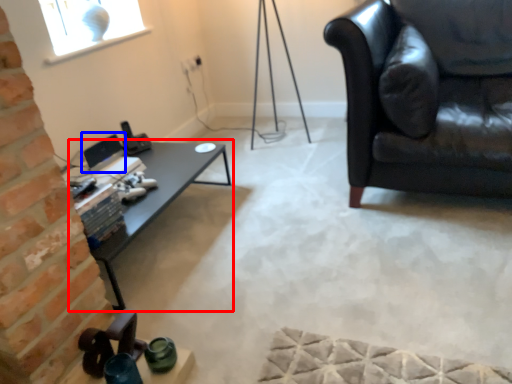
Question: Which point is further to the camera, table (highlighted by a red box) or computer monitor (highlighted by a blue box)?

Choices:
 (A) table
 (B) computer monitor

Answer: (B)